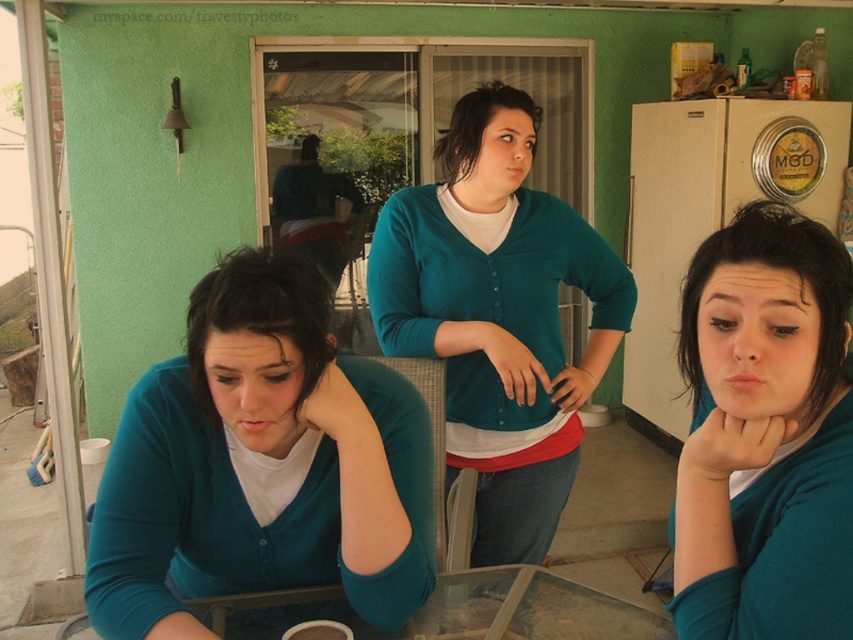
Between point (688, 349) and point (436, 595), which one is positioned in front?

Point (688, 349) is more forward.

The height and width of the screenshot is (640, 853). I want to click on matte teal sweater at center, so click(764, 435).

Can you confirm if matte teal sweater at center is positioned above teal matte cardigan at center?

Actually, matte teal sweater at center is below teal matte cardigan at center.

Between matte teal sweater at center and teal matte cardigan at center, which one appears on the left side from the viewer's perspective?

teal matte cardigan at center

You are a GUI agent. You are given a task and a screenshot of the screen. Output one action in this format:
    pyautogui.click(x=<x>, y=<y>)
    Task: Click on the matte teal sweater at center
    Image resolution: width=853 pixels, height=640 pixels.
    Given the screenshot: What is the action you would take?
    pyautogui.click(x=764, y=435)

You are a GUI agent. You are given a task and a screenshot of the screen. Output one action in this format:
    pyautogui.click(x=<x>, y=<y>)
    Task: Click on the matte teal sweater at center
    The image size is (853, 640).
    Given the screenshot: What is the action you would take?
    pyautogui.click(x=764, y=435)

Does teal matte cardigan at center have a greater height compared to transparent glass table at center?

Yes, teal matte cardigan at center is taller than transparent glass table at center.

Which is behind, point (480, 248) or point (463, 625)?

Point (480, 248)

Is point (547, 547) closer to camera compared to point (462, 596)?

That is False.

At what (x,y) coordinates should I click in order to perform the action: click on teal matte cardigan at center. Please return your answer as a coordinate pair (x, y). Looking at the image, I should click on (498, 316).